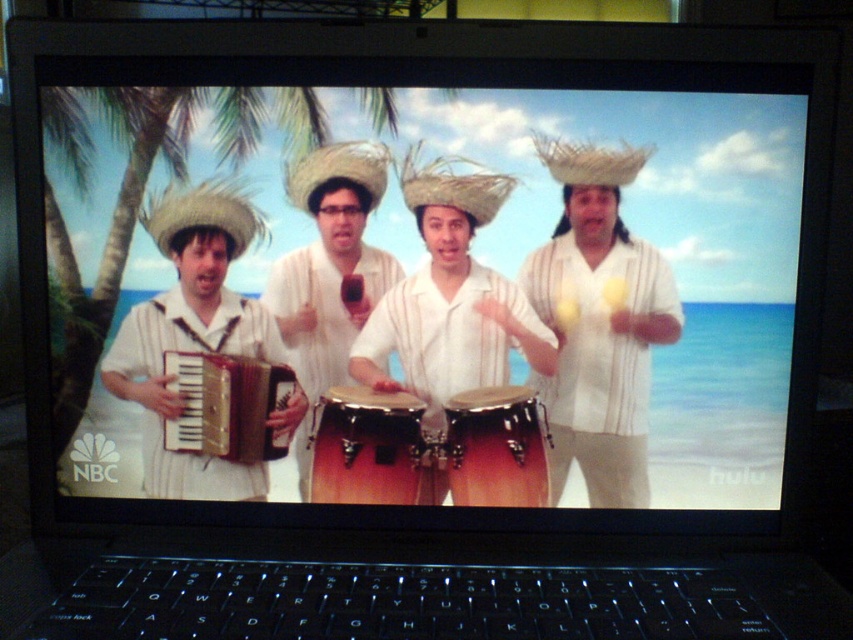
What object is located at the coordinates point (227,404) on the laptop screen?

The point (227,404) marks the gold metallic accordion at left.